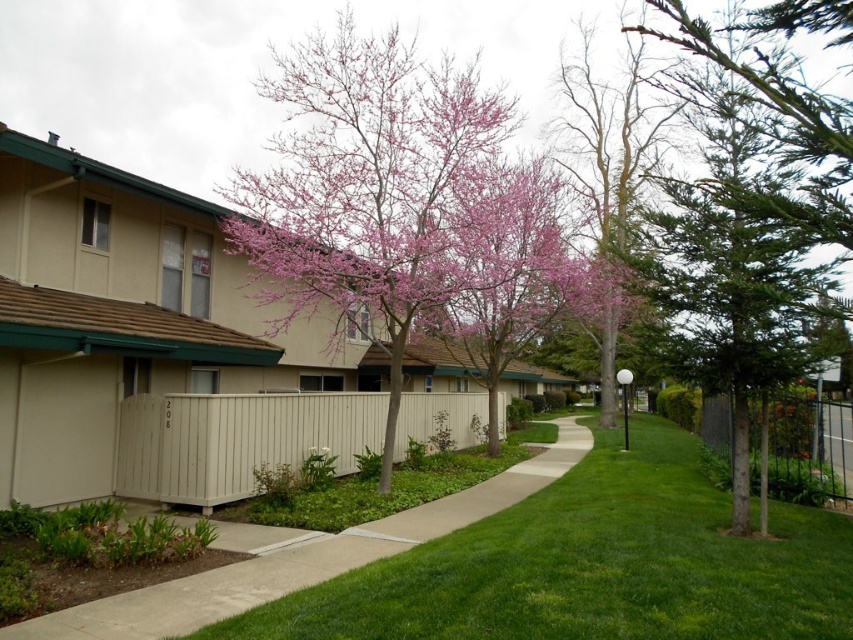
Question: Which object appears farthest from the camera in this image?

Choices:
 (A) green needle-like tree at right
 (B) pink bloom tree at center
 (C) beige wood fence at center
 (D) smooth concrete sidewalk at center

Answer: (C)

Question: Is pink bloom tree at center bigger than beige wood fence at center?

Choices:
 (A) yes
 (B) no

Answer: (A)

Question: Does bare wood tree at center have a greater width compared to metallic silver fence at right?

Choices:
 (A) yes
 (B) no

Answer: (A)

Question: Does pink bloom tree at center appear under bare wood tree at center?

Choices:
 (A) no
 (B) yes

Answer: (A)

Question: Which point is closer to the camera taking this photo?

Choices:
 (A) (842, 157)
 (B) (503, 492)
 (C) (236, 221)
 (D) (265, 410)

Answer: (A)

Question: Which object is the farthest from the pink bloom tree at center?

Choices:
 (A) bare wood tree at center
 (B) beige wood fence at center
 (C) metallic silver fence at right
 (D) green needle-like tree at right

Answer: (C)